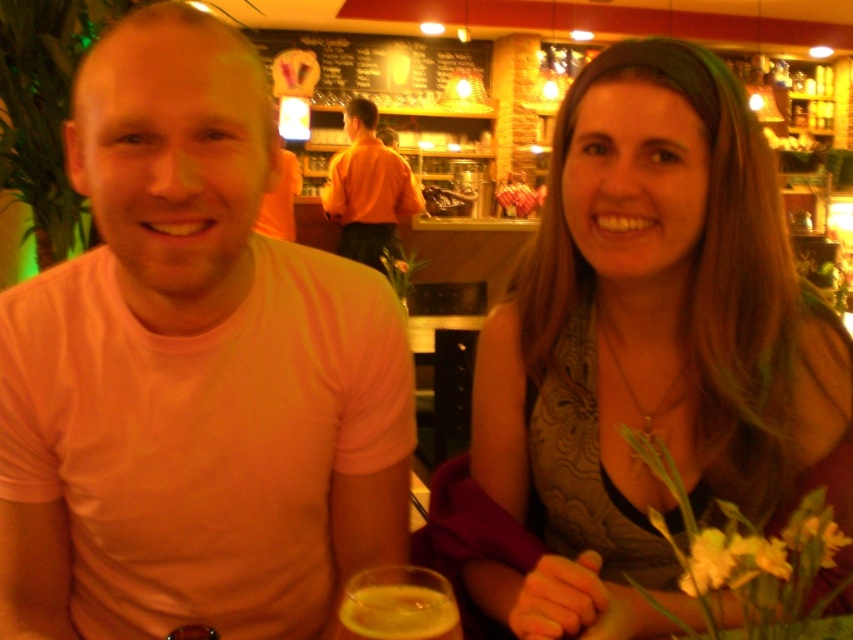
Describe the element at coordinates (367, 188) in the screenshot. I see `orange shirt at center` at that location.

Who is lower down, orange shirt at center or amber glass beer at lower center?

amber glass beer at lower center is below.

The height and width of the screenshot is (640, 853). I want to click on orange shirt at center, so click(x=367, y=188).

The image size is (853, 640). I want to click on orange shirt at center, so click(x=367, y=188).

Does point (701, 72) lie behind point (375, 115)?

No, it is in front of (375, 115).

Describe the element at coordinates (650, 349) in the screenshot. I see `matte gray tank top at center` at that location.

Who is more distant from viewer, (x=700, y=451) or (x=345, y=106)?

Positioned behind is point (x=345, y=106).

Where is `matte gray tank top at center`? This screenshot has width=853, height=640. matte gray tank top at center is located at coordinates (650, 349).

Can you confirm if pink cotton shirt at center is positioned to the left of amber glass beer at lower center?

Correct, you'll find pink cotton shirt at center to the left of amber glass beer at lower center.

Is pink cotton shirt at center wider than amber glass beer at lower center?

Indeed, pink cotton shirt at center has a greater width compared to amber glass beer at lower center.

This screenshot has height=640, width=853. Identify the location of pink cotton shirt at center. (192, 372).